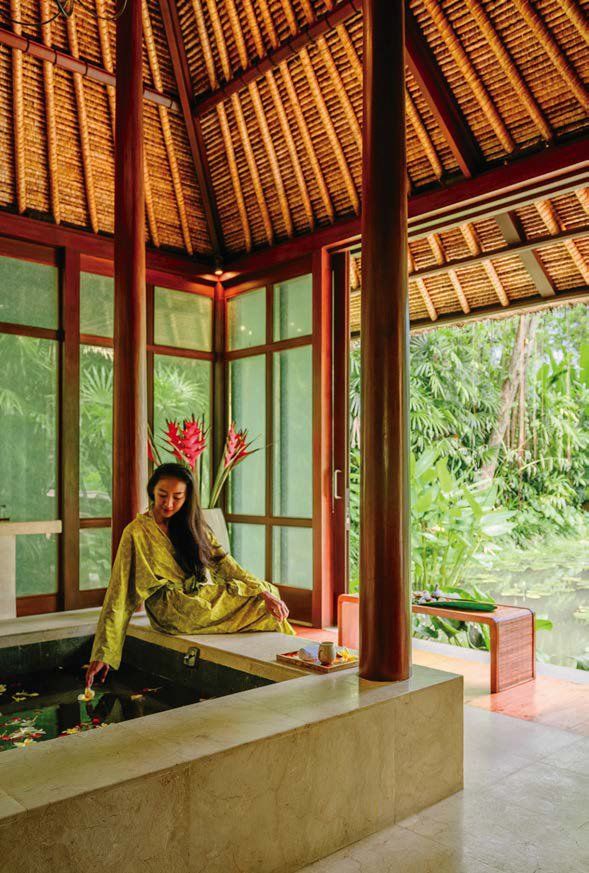
The image size is (589, 873). Find the location of `tray`. tray is located at coordinates (325, 670), (284, 656), (350, 665).